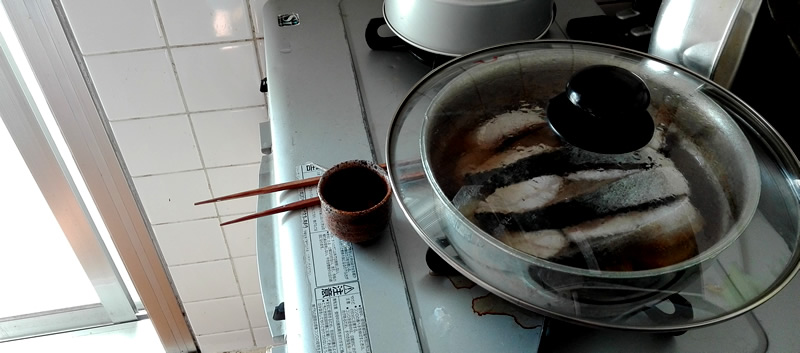
The width and height of the screenshot is (800, 353). In order to click on pot in this screenshot , I will do `click(500, 275)`, `click(418, 37)`.